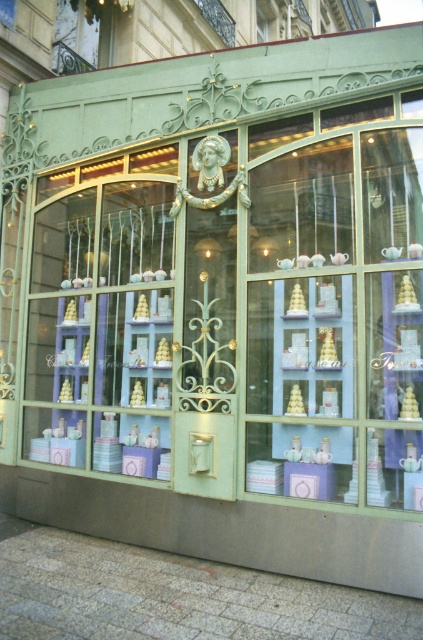
Question: Where is matte glass door at center located in relation to metallic wrought iron at upper left in the image?

Choices:
 (A) right
 (B) left

Answer: (A)

Question: Among these objects, which one is farthest from the camera?

Choices:
 (A) metallic wrought iron at upper left
 (B) matte glass door at center

Answer: (A)

Question: Is matte glass door at center thinner than metallic wrought iron at upper left?

Choices:
 (A) yes
 (B) no

Answer: (B)

Question: Which point is closer to the camera?

Choices:
 (A) (112, 38)
 (B) (398, 387)

Answer: (B)

Question: Can you confirm if matte glass door at center is positioned above metallic wrought iron at upper left?

Choices:
 (A) no
 (B) yes

Answer: (A)